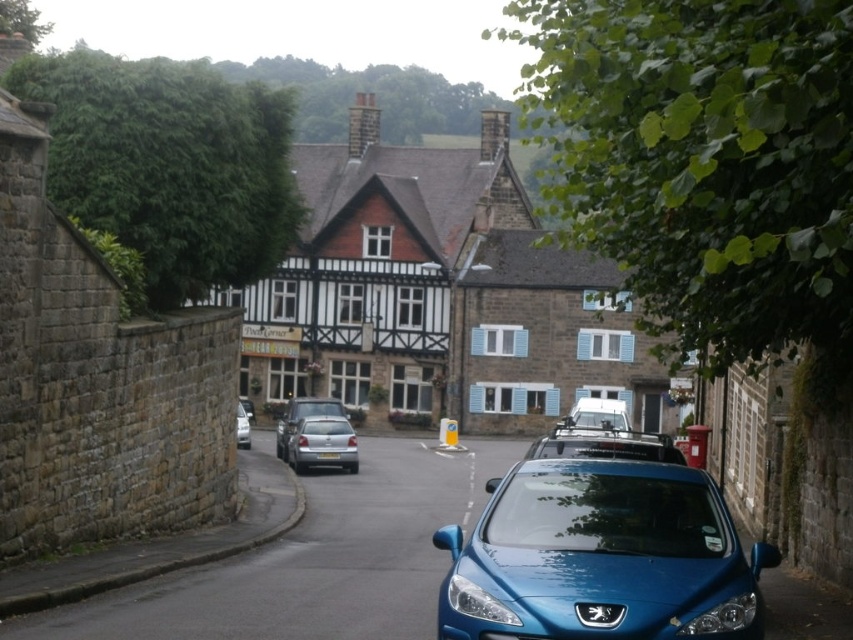
Does silver metallic hatchback at center have a lesser width compared to silver metallic car at center?

Correct, silver metallic hatchback at center's width is less than silver metallic car at center's.

Is silver metallic hatchback at center taller than silver metallic car at center?

In fact, silver metallic hatchback at center may be shorter than silver metallic car at center.

Does point (282, 438) come in front of point (239, 433)?

That is True.

Where is `silver metallic hatchback at center`? silver metallic hatchback at center is located at coordinates (302, 417).

Does point (526, 589) lie in front of point (241, 403)?

Yes.

Does metallic blue car at lower center appear under metallic silver car at center?

Actually, metallic blue car at lower center is above metallic silver car at center.

Does point (529, 513) come in front of point (241, 400)?

Yes, point (529, 513) is closer to viewer.

Identify the location of metallic blue car at lower center. The height and width of the screenshot is (640, 853). (601, 557).

Consider the image. Who is taller, blue metallic car at center or satin silver car at center?

satin silver car at center is taller.

Is point (378, 605) in front of point (311, 433)?

Yes, it is in front of point (311, 433).

The width and height of the screenshot is (853, 640). Identify the location of blue metallic car at center. (312, 561).

The image size is (853, 640). I want to click on blue metallic car at center, so click(312, 561).